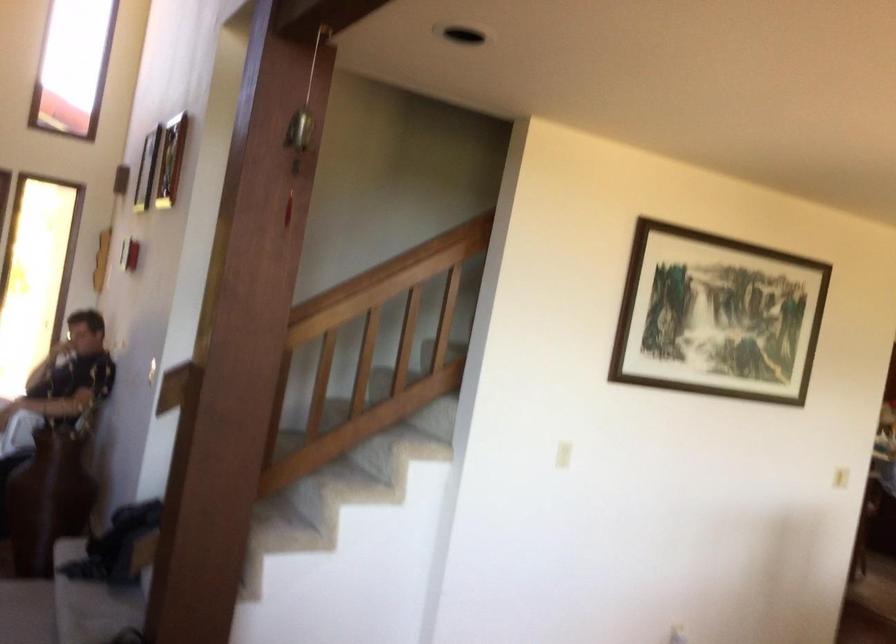
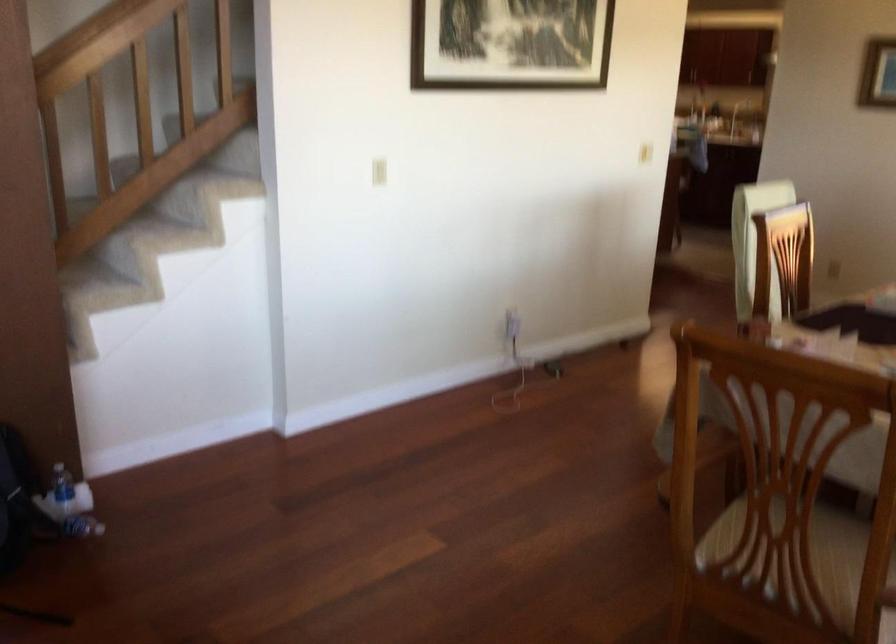
Where in the second image is the point corresponding to point (566, 458) from the first image?

(378, 172)